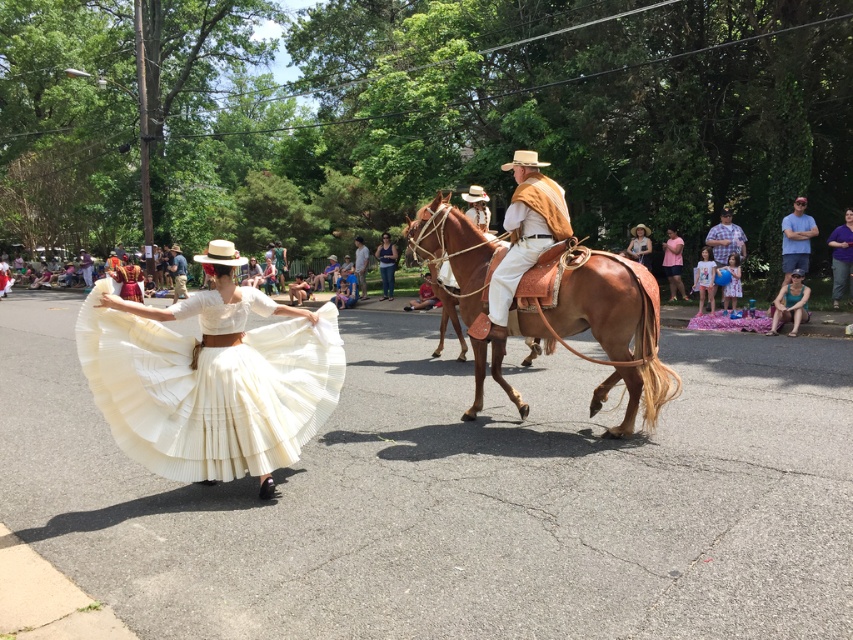
Question: Can you confirm if pink cotton dress at center is wider than pink fabric dress at center?

Choices:
 (A) yes
 (B) no

Answer: (A)

Question: Which of the following is the farthest from the observer?

Choices:
 (A) light brown leather cowboy hat at center
 (B) white pleated skirt at center
 (C) pink fabric dress at center
 (D) blue denim shirt at right

Answer: (A)

Question: Is light brown leather saddle at center above light brown leather hat at center?

Choices:
 (A) yes
 (B) no

Answer: (B)

Question: Does purple cotton shirt at center appear on the right side of pink fabric dress at center?

Choices:
 (A) no
 (B) yes

Answer: (B)

Question: Which of these objects is positioned closest to the blue denim shirt at center?

Choices:
 (A) light brown leather saddle at center
 (B) dark blue denim jeans at center
 (C) brown leather horse at center
 (D) light brown leather hat at center

Answer: (B)

Question: Which object is closer to the camera taking this photo?

Choices:
 (A) light brown leather saddle at center
 (B) purple cotton shirt at center
 (C) checkered fabric shirt at right
 (D) pink fabric dress at center

Answer: (A)